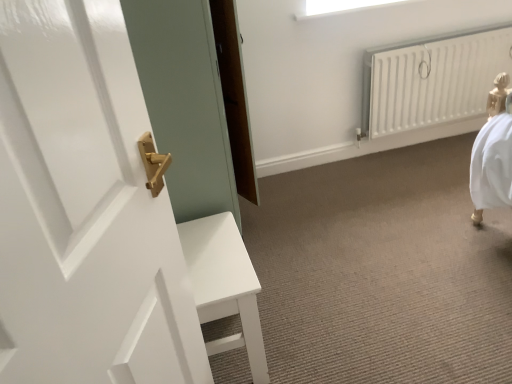
Question: From the image's perspective, is white glossy door handle at upper left located beneath white matte radiator at upper right?

Choices:
 (A) no
 (B) yes

Answer: (B)

Question: From a real-world perspective, is white glossy door handle at upper left positioned over white matte radiator at upper right based on gravity?

Choices:
 (A) no
 (B) yes

Answer: (B)

Question: Is white glossy door handle at upper left further to camera compared to white matte radiator at upper right?

Choices:
 (A) yes
 (B) no

Answer: (B)

Question: Is white glossy door handle at upper left closer to camera compared to white matte radiator at upper right?

Choices:
 (A) no
 (B) yes

Answer: (B)

Question: Is white glossy door handle at upper left looking in the opposite direction of white matte radiator at upper right?

Choices:
 (A) no
 (B) yes

Answer: (A)

Question: Is white glossy door handle at upper left to the left of white matte radiator at upper right from the viewer's perspective?

Choices:
 (A) no
 (B) yes

Answer: (B)

Question: Is white matte radiator at upper right bigger than white glossy door handle at upper left?

Choices:
 (A) no
 (B) yes

Answer: (B)

Question: Is white matte radiator at upper right touching white glossy door handle at upper left?

Choices:
 (A) no
 (B) yes

Answer: (A)

Question: From the image's perspective, is white matte radiator at upper right under white glossy door handle at upper left?

Choices:
 (A) yes
 (B) no

Answer: (B)

Question: Is white matte radiator at upper right not near white glossy door handle at upper left?

Choices:
 (A) yes
 (B) no

Answer: (A)

Question: From a real-world perspective, is white matte radiator at upper right positioned over white glossy door handle at upper left based on gravity?

Choices:
 (A) yes
 (B) no

Answer: (B)

Question: Is white matte radiator at upper right wider than white glossy door handle at upper left?

Choices:
 (A) yes
 (B) no

Answer: (A)

Question: Based on their sizes in the image, would you say white matte radiator at upper right is bigger or smaller than white glossy door handle at upper left?

Choices:
 (A) small
 (B) big

Answer: (B)